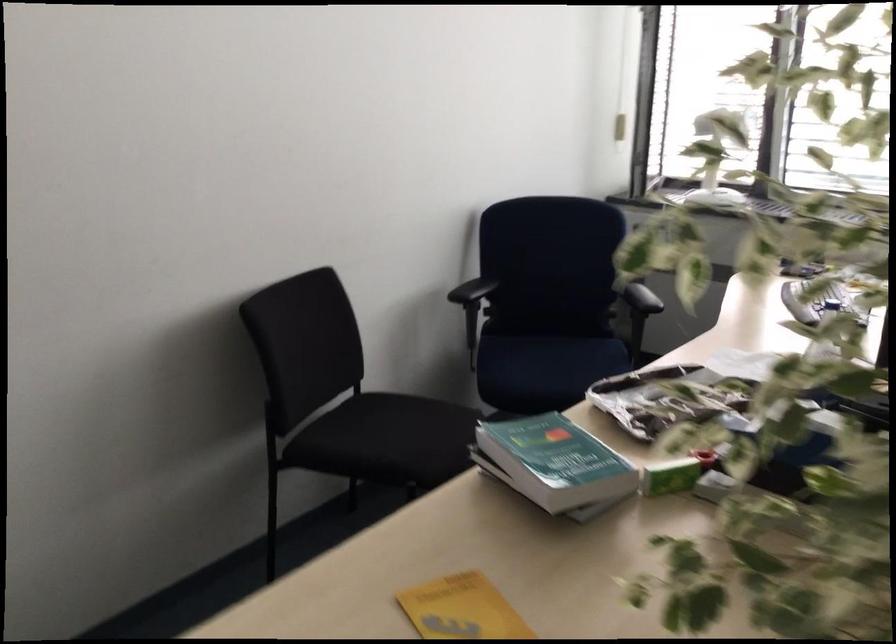
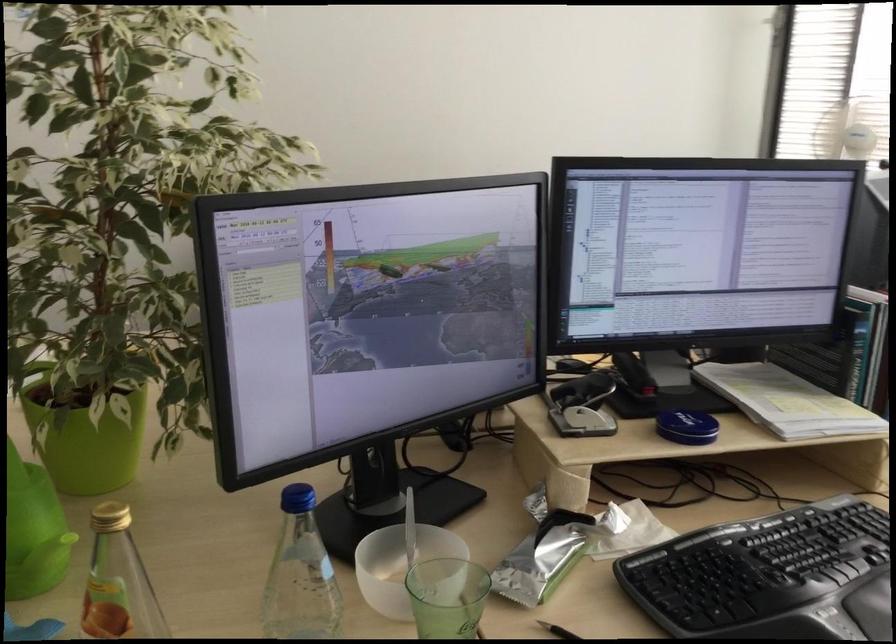
Question: I am providing you with two images of the same scene from different viewpoints. Which of the following objects are not visible in image2?

Choices:
 (A) stapler lever
 (B) closet door knob
 (C) clear water bottle
 (D) blue chair sitting surface

Answer: (D)